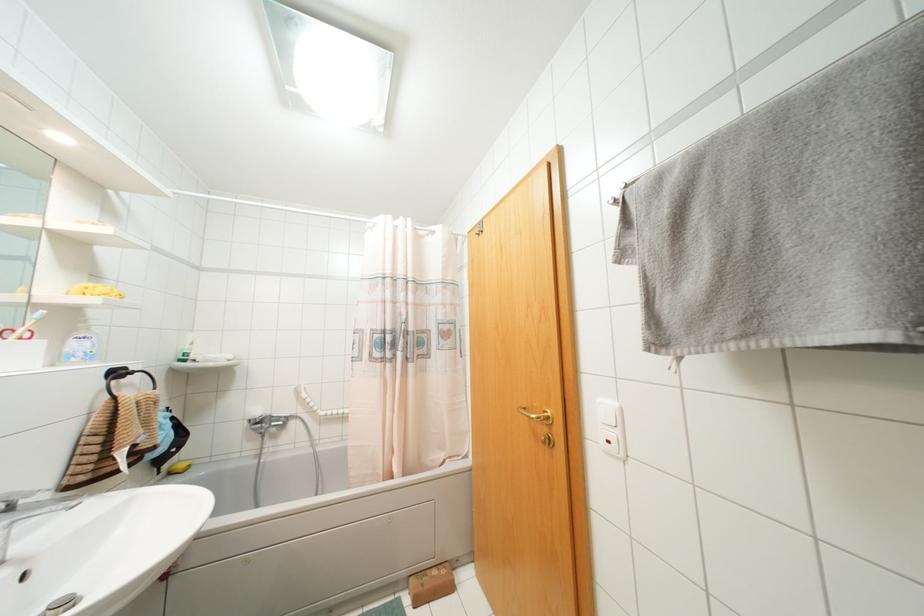
Find where to push the soap dispenser pump. Please return your answer as a coordinate pair (x, y).

(87, 320)